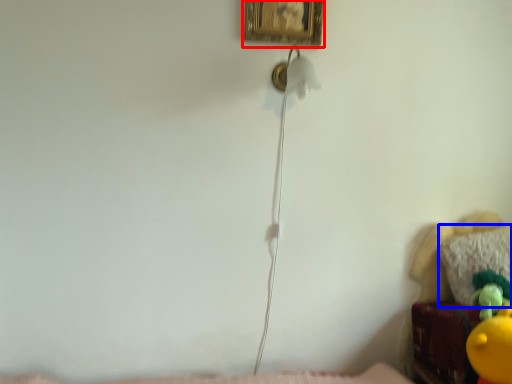
Question: Which of the following is the farthest to the observer, picture frame (highlighted by a red box) or pillow (highlighted by a blue box)?

Choices:
 (A) picture frame
 (B) pillow

Answer: (B)